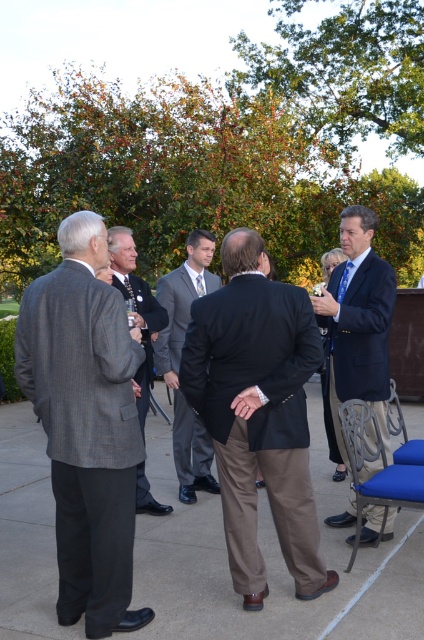
Question: Does dark brown suit at center have a smaller size compared to dark blue suit at center?

Choices:
 (A) no
 (B) yes

Answer: (B)

Question: Which of the following is the closest to the observer?

Choices:
 (A) dark brown suit at center
 (B) dark blue suit at center
 (C) gray wool suit at center
 (D) gray wool suit at left

Answer: (D)

Question: Is gray wool suit at left wider than gray wool suit at center?

Choices:
 (A) yes
 (B) no

Answer: (A)

Question: Among these objects, which one is farthest from the camera?

Choices:
 (A) dark brown suit at center
 (B) gray wool suit at center
 (C) gray suit at center

Answer: (C)

Question: Is dark blue suit at center to the right of gray wool suit at center from the viewer's perspective?

Choices:
 (A) no
 (B) yes

Answer: (B)

Question: Which object is farther from the camera taking this photo?

Choices:
 (A) gray wool suit at center
 (B) dark brown suit at center

Answer: (A)